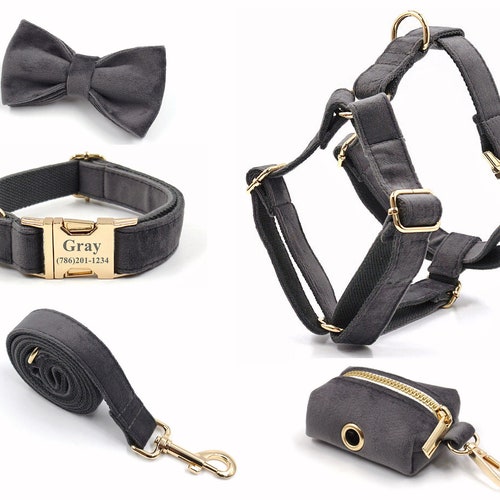
At what (x,y) coordinates should I click in order to perform the action: click on latch. Please return your answer as a coordinate pair (x, y). The image size is (500, 500). Looking at the image, I should click on (205, 464).